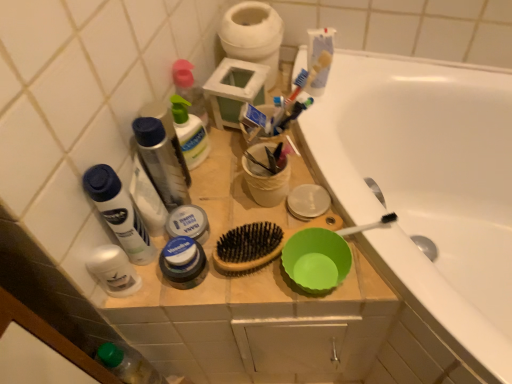
Locate an element on the screen. The height and width of the screenshot is (384, 512). vacant area located to the right-hand side of translucent plastic spray bottle at upper center is located at coordinates (244, 150).